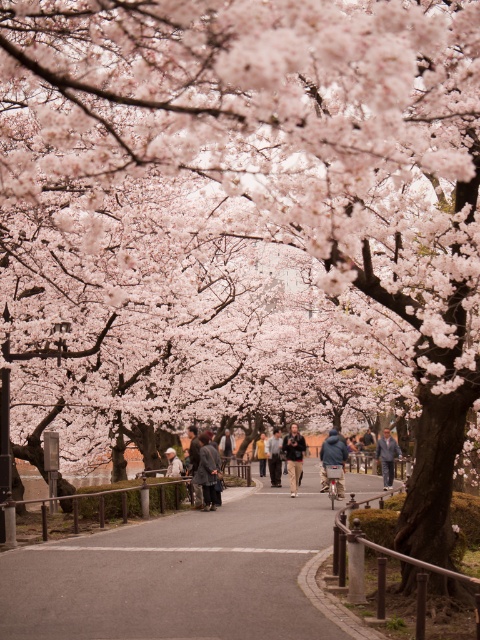
Is dark blue jacket at center shorter than denim jacket at center?

No, dark blue jacket at center is not shorter than denim jacket at center.

Which is more to the right, dark blue jacket at center or denim jacket at center?

Positioned to the right is denim jacket at center.

Is point (285, 451) in front of point (383, 440)?

Yes, it is in front of point (383, 440).

At what (x,y) coordinates should I click in order to perform the action: click on dark blue jacket at center. Please return your answer as a coordinate pair (x, y). This screenshot has height=640, width=480. Looking at the image, I should click on (294, 456).

Is dark gray coat at center wider than blue denim jacket at center?

No, dark gray coat at center is not wider than blue denim jacket at center.

Based on the photo, between dark gray coat at center and blue denim jacket at center, which one is positioned higher?

dark gray coat at center is higher up.

Who is more distant from viewer, (211, 504) or (324, 486)?

Positioned behind is point (324, 486).

This screenshot has height=640, width=480. Identify the location of dark gray coat at center. (207, 472).

How much distance is there between asphalt road at center and light beige fabric jacket at center?

A distance of 30.49 feet exists between asphalt road at center and light beige fabric jacket at center.

Between point (216, 556) and point (177, 467), which one is positioned behind?

The point (177, 467) is more distant.

I want to click on asphalt road at center, so point(179,573).

Where is `asphalt road at center`? Image resolution: width=480 pixels, height=640 pixels. asphalt road at center is located at coordinates (179, 573).